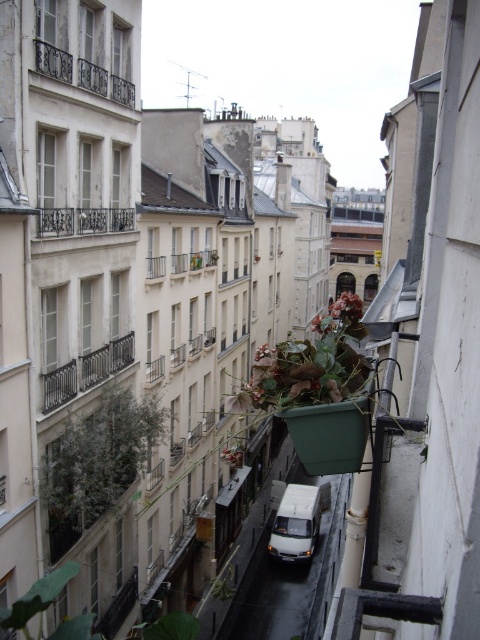
Does white matte van at center have a greater width compared to dark gray metal balcony at center-left?

Correct, the width of white matte van at center exceeds that of dark gray metal balcony at center-left.

Measure the distance between white matte van at center and camera.

The distance of white matte van at center from camera is 34.31 meters.

Locate an element on the screen. The image size is (480, 640). white matte van at center is located at coordinates (298, 522).

Measure the distance from dark wrought iron balcony at upper left to wooden balcony at center.

A distance of 10.02 meters exists between dark wrought iron balcony at upper left and wooden balcony at center.

Between dark wrought iron balcony at upper left and wooden balcony at center, which one has less height?

dark wrought iron balcony at upper left

Which is behind, point (39, 58) or point (204, 257)?

The point (204, 257) is behind.

You are a GUI agent. You are given a task and a screenshot of the screen. Output one action in this format:
    pyautogui.click(x=<x>, y=<y>)
    Task: Click on the dark wrought iron balcony at upper left
    The height and width of the screenshot is (640, 480).
    Given the screenshot: What is the action you would take?
    pyautogui.click(x=105, y=83)

Can you confirm if green leafy plant at center is positioned to the right of dark gray metal balcony at center-left?

Yes, green leafy plant at center is to the right of dark gray metal balcony at center-left.

Where is `green leafy plant at center`? green leafy plant at center is located at coordinates (99, 458).

Where is `green leafy plant at center`? The image size is (480, 640). green leafy plant at center is located at coordinates (99, 458).